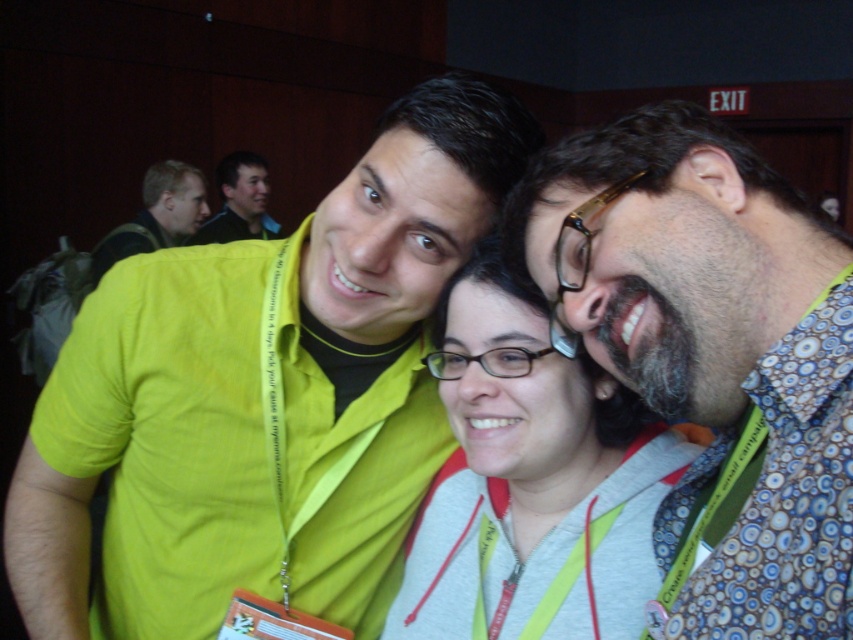
At what (x,y) coordinates should I click in order to perform the action: click on patterned fabric shirt at center. Please return your answer as a coordinate pair (x, y). Looking at the image, I should click on (712, 355).

Who is taller, patterned fabric shirt at center or matte yellow shirt at upper left?

With more height is matte yellow shirt at upper left.

Between point (810, 586) and point (161, 170), which one is positioned behind?

Point (161, 170)

Find the location of a particular element. This screenshot has width=853, height=640. patterned fabric shirt at center is located at coordinates (712, 355).

Does point (149, 461) lie in front of point (538, 356)?

No, it is not.

Is green matte shirt at center smaller than gray fleece at center?

Incorrect, green matte shirt at center is not smaller in size than gray fleece at center.

Between point (175, 470) and point (677, 440), which one is positioned behind?

The point (175, 470) is more distant.

Locate an element on the screen. This screenshot has width=853, height=640. green matte shirt at center is located at coordinates (262, 397).

Does matte yellow shirt at upper left appear on the right side of matte black shirt at upper left?

In fact, matte yellow shirt at upper left is to the left of matte black shirt at upper left.

Which is more to the right, matte yellow shirt at upper left or matte black shirt at upper left?

From the viewer's perspective, matte black shirt at upper left appears more on the right side.

Is point (198, 180) more distant than point (242, 186)?

No, it is in front of (242, 186).

Where is `matte yellow shirt at upper left`? This screenshot has height=640, width=853. matte yellow shirt at upper left is located at coordinates (155, 216).